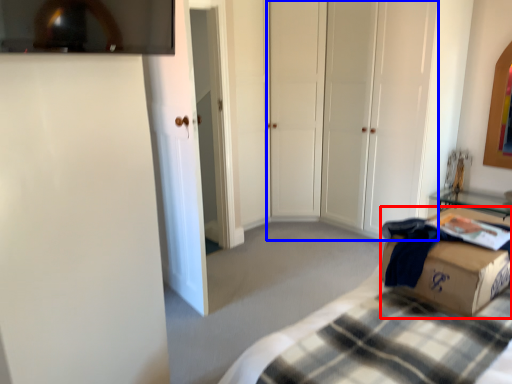
Question: Which object appears farthest to the camera in this image, box (highlighted by a red box) or glass door (highlighted by a blue box)?

Choices:
 (A) box
 (B) glass door

Answer: (B)